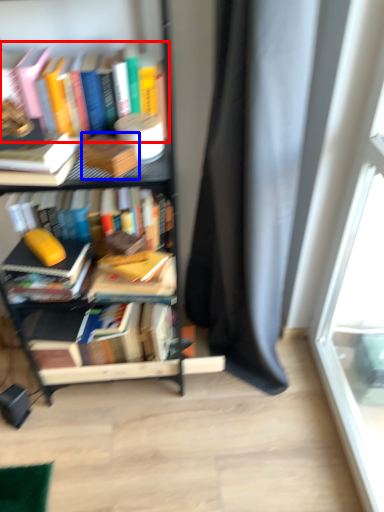
Question: Which point is closer to the camera, book (highlighted by a red box) or paperback book (highlighted by a blue box)?

Choices:
 (A) book
 (B) paperback book

Answer: (B)